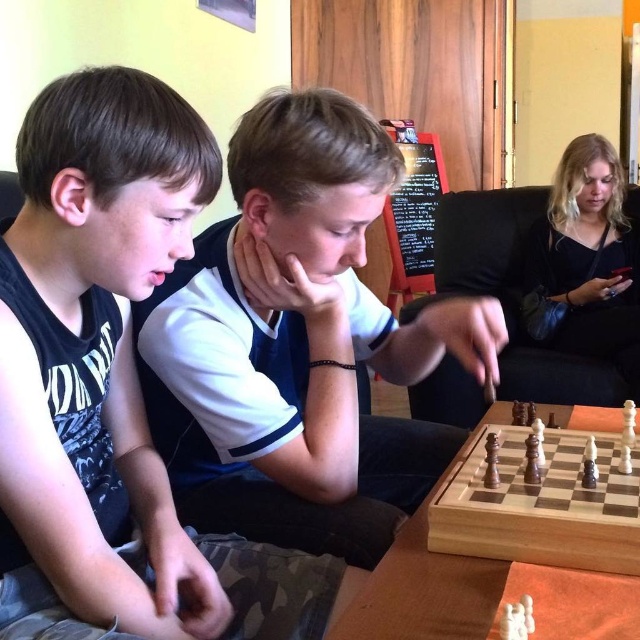
Question: Which point is closer to the camera taking this photo?

Choices:
 (A) (125, 499)
 (B) (285, 109)

Answer: (A)

Question: Is black matte shirt at left above light wood chess set at center?

Choices:
 (A) yes
 (B) no

Answer: (A)

Question: Considering the real-world distances, which object is farthest from the light wood chess set at center?

Choices:
 (A) black matte shirt at left
 (B) white matte shirt at center

Answer: (A)

Question: Can you confirm if white matte shirt at center is positioned to the right of light wood chess set at center?

Choices:
 (A) no
 (B) yes

Answer: (A)

Question: Which of the following is the farthest from the observer?

Choices:
 (A) black matte shirt at left
 (B) white matte shirt at center
 (C) light wood chess set at center

Answer: (B)

Question: Is the position of black matte shirt at left less distant than that of light wood chess set at center?

Choices:
 (A) yes
 (B) no

Answer: (A)